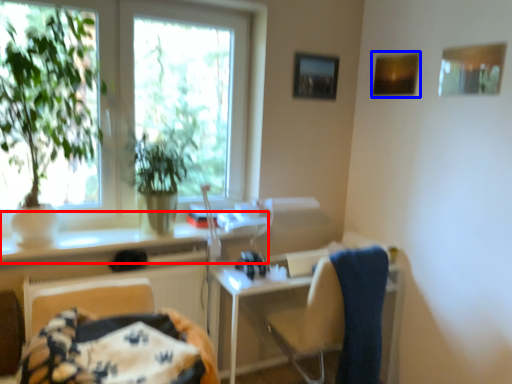
Question: Which object appears farthest to the camera in this image, counter top (highlighted by a red box) or picture frame (highlighted by a blue box)?

Choices:
 (A) counter top
 (B) picture frame

Answer: (B)